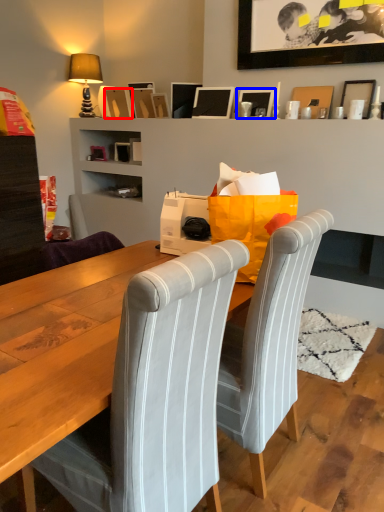
Question: Which object appears farthest to the camera in this image, picture frame (highlighted by a red box) or picture frame (highlighted by a blue box)?

Choices:
 (A) picture frame
 (B) picture frame

Answer: (A)